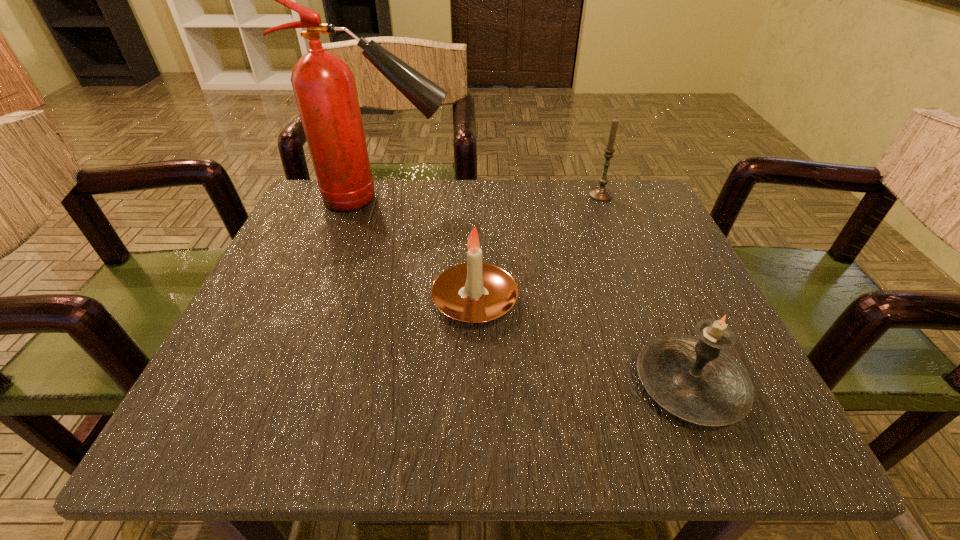
At what (x,y) coordinates should I click in order to perform the action: click on free space between the second nearest object and the nearest candle. Please return your answer as a coordinate pair (x, y). Looking at the image, I should click on (582, 343).

I want to click on empty space that is in between the leftmost candle and the tallest object, so click(429, 251).

Find the location of a particular element. empty space that is in between the nearest candle and the second nearest object is located at coordinates (582, 343).

What are the coordinates of `vacant point located between the tallest object and the leftmost candle` in the screenshot? It's located at (429, 251).

Where is `the second closest object to the nearest candle`? The height and width of the screenshot is (540, 960). the second closest object to the nearest candle is located at coordinates (600, 193).

Image resolution: width=960 pixels, height=540 pixels. I want to click on object that is the third nearest to the leftmost candle, so click(600, 193).

Where is `candle that can be found as the third closest to the tallest object`? candle that can be found as the third closest to the tallest object is located at coordinates (695, 379).

Choose which candle is the second nearest neighbor to the nearest object. Please provide its 2D coordinates. Your answer should be formatted as a tuple, i.e. [(x, y)], where the tuple contains the x and y coordinates of a point satisfying the conditions above.

[(600, 193)]

At what (x,y) coordinates should I click in order to perform the action: click on vacant point that satisfies the following two spatial constraints: 1. at the nozzle end of the leftmost candle; 2. on the right side of the fire extinguisher. Please return your answer as a coordinate pair (x, y). The width and height of the screenshot is (960, 540). Looking at the image, I should click on (351, 302).

This screenshot has height=540, width=960. Identify the location of vacant region that satisfies the following two spatial constraints: 1. on the back side of the farthest candle; 2. on the right side of the leftmost candle. (476, 195).